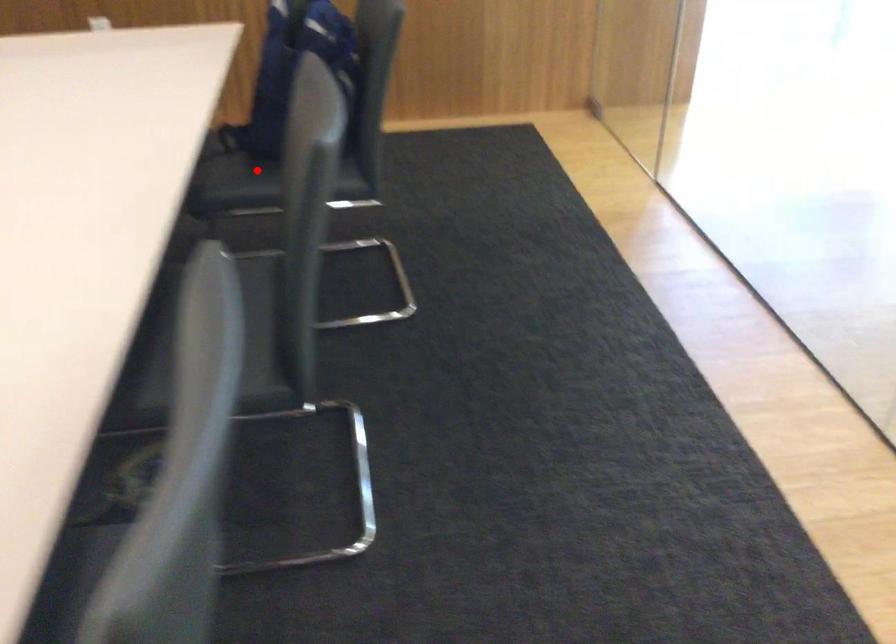
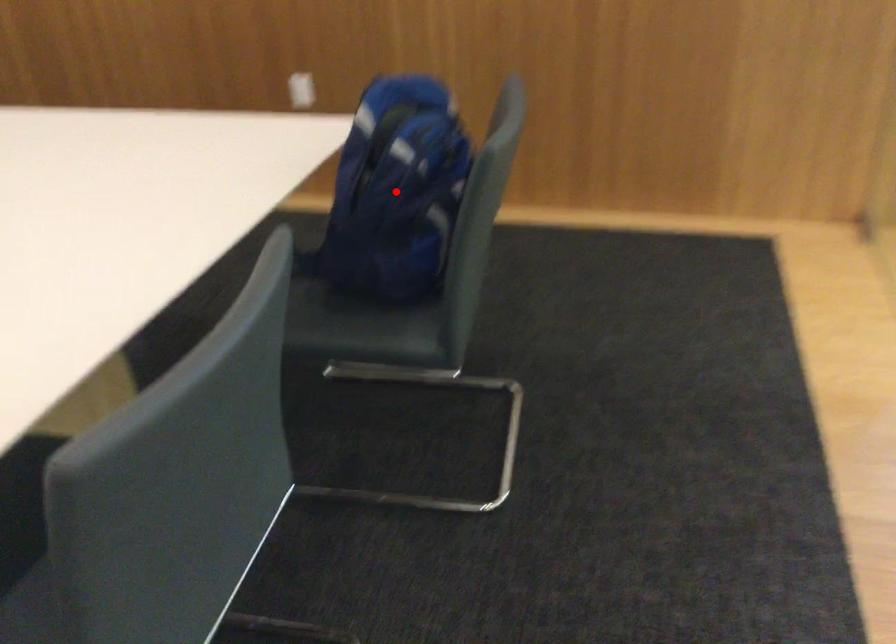
I am providing you with two images of the same scene from different viewpoints. A red point is marked on the first image and another point is marked on the second image. Is the red point in image1 aligned with the point shown in image2?

No